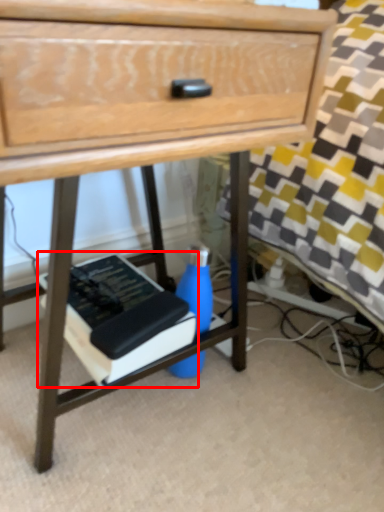
Question: In this image, where is paperback book (annotated by the red box) located relative to bottle?

Choices:
 (A) right
 (B) left

Answer: (B)